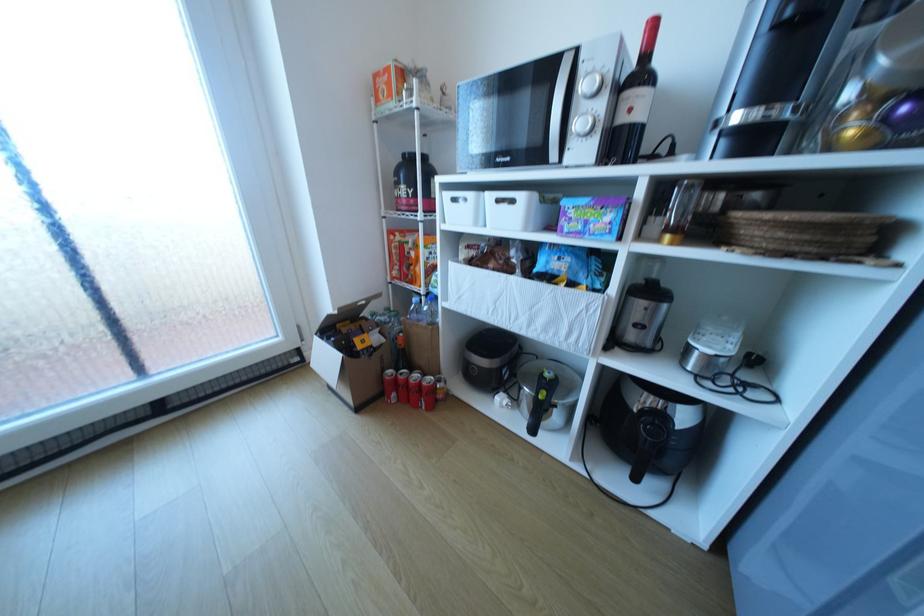
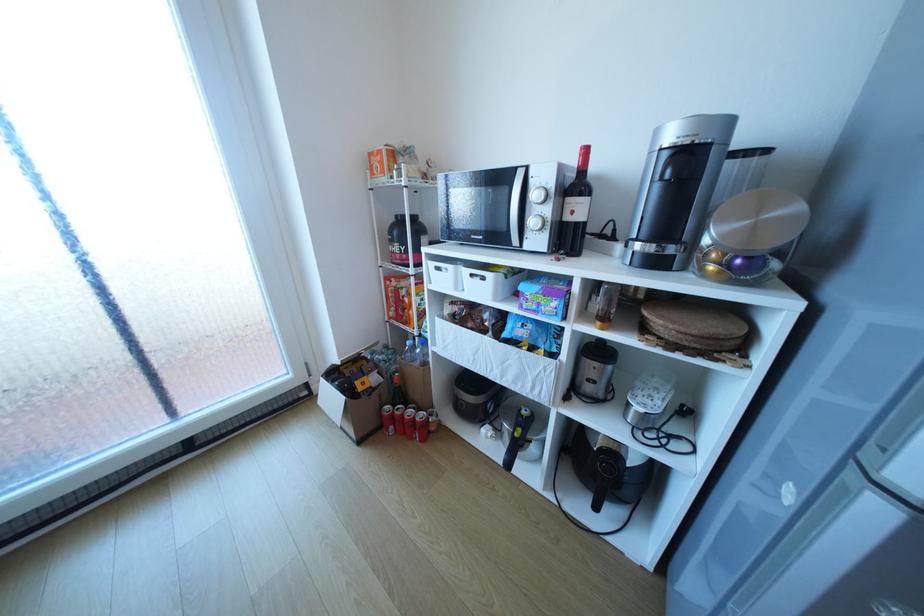
Locate, in the second image, the point that corresponds to [406,315] in the first image.

(402, 354)